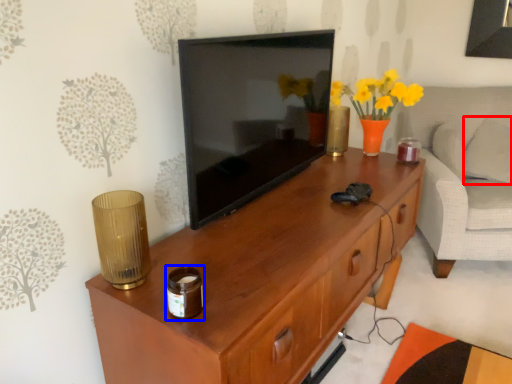
Question: Which object appears farthest to the camera in this image, pillow (highlighted by a red box) or candle holder (highlighted by a blue box)?

Choices:
 (A) pillow
 (B) candle holder

Answer: (A)